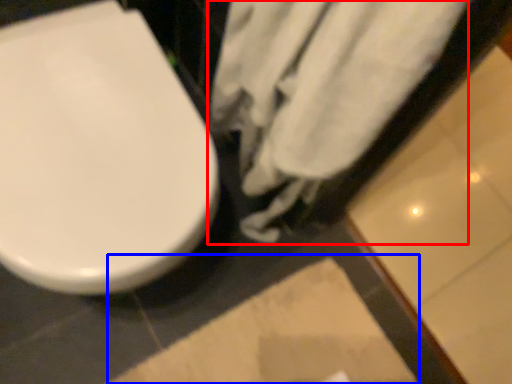
Question: Which of the following is the closest to the observer, bath towel (highlighted by a red box) or square (highlighted by a blue box)?

Choices:
 (A) bath towel
 (B) square

Answer: (A)